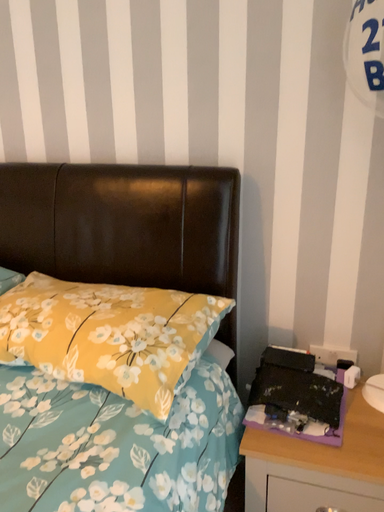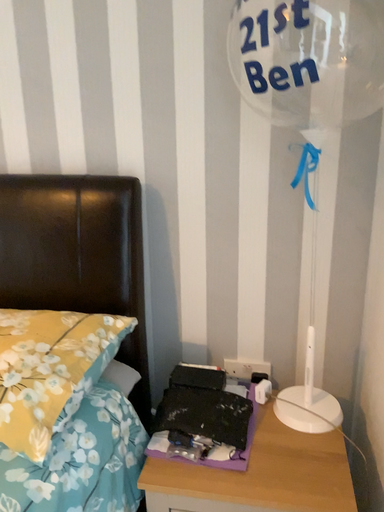
Question: Which way did the camera rotate in the video?

Choices:
 (A) rotated left
 (B) rotated right

Answer: (B)